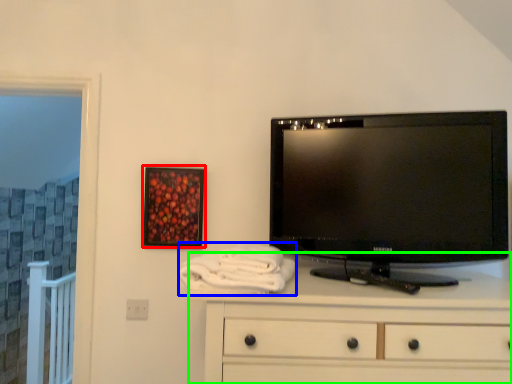
Question: Which object is the farthest from picture frame (highlighted by a red box)? Choose among these: bath towel (highlighted by a blue box) or chest of drawers (highlighted by a green box).

Choices:
 (A) bath towel
 (B) chest of drawers

Answer: (B)